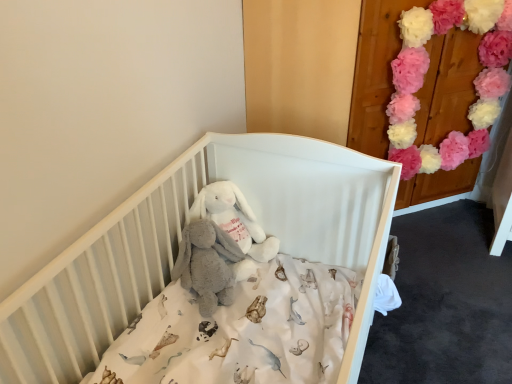
Question: Could you tell me if pink fluffy pom-poms at upper right is facing white plush rabbit at center?

Choices:
 (A) no
 (B) yes

Answer: (A)

Question: Does pink fluffy pom-poms at upper right have a larger size compared to white plush rabbit at center?

Choices:
 (A) no
 (B) yes

Answer: (B)

Question: From the image's perspective, is pink fluffy pom-poms at upper right located beneath white plush rabbit at center?

Choices:
 (A) yes
 (B) no

Answer: (B)

Question: Can you confirm if pink fluffy pom-poms at upper right is positioned to the left of white plush rabbit at center?

Choices:
 (A) no
 (B) yes

Answer: (A)

Question: Considering the relative sizes of pink fluffy pom-poms at upper right and white plush rabbit at center in the image provided, is pink fluffy pom-poms at upper right wider than white plush rabbit at center?

Choices:
 (A) yes
 (B) no

Answer: (B)

Question: Is pink fluffy pom-poms at upper right wider or thinner than soft gray plush at center?

Choices:
 (A) wide
 (B) thin

Answer: (B)

Question: Choose the correct answer: Is pink fluffy pom-poms at upper right inside soft gray plush at center or outside it?

Choices:
 (A) inside
 (B) outside

Answer: (B)

Question: From the image's perspective, is pink fluffy pom-poms at upper right located above or below soft gray plush at center?

Choices:
 (A) above
 (B) below

Answer: (A)

Question: Would you say pink fluffy pom-poms at upper right is to the left or to the right of soft gray plush at center in the picture?

Choices:
 (A) right
 (B) left

Answer: (A)

Question: Considering the positions of point (30, 379) and point (216, 274), is point (30, 379) closer or farther from the camera than point (216, 274)?

Choices:
 (A) farther
 (B) closer

Answer: (B)

Question: Considering the positions of white matte crib at center and soft gray plush at center in the image, is white matte crib at center bigger or smaller than soft gray plush at center?

Choices:
 (A) big
 (B) small

Answer: (A)

Question: From the image's perspective, is white matte crib at center above or below soft gray plush at center?

Choices:
 (A) below
 (B) above

Answer: (A)

Question: Considering the positions of white matte crib at center and soft gray plush at center in the image, is white matte crib at center wider or thinner than soft gray plush at center?

Choices:
 (A) thin
 (B) wide

Answer: (B)

Question: Is pink fluffy pom-poms at upper right to the left or to the right of white plush rabbit at center in the image?

Choices:
 (A) right
 (B) left

Answer: (A)

Question: Looking at the image, does pink fluffy pom-poms at upper right seem bigger or smaller compared to white plush rabbit at center?

Choices:
 (A) small
 (B) big

Answer: (B)